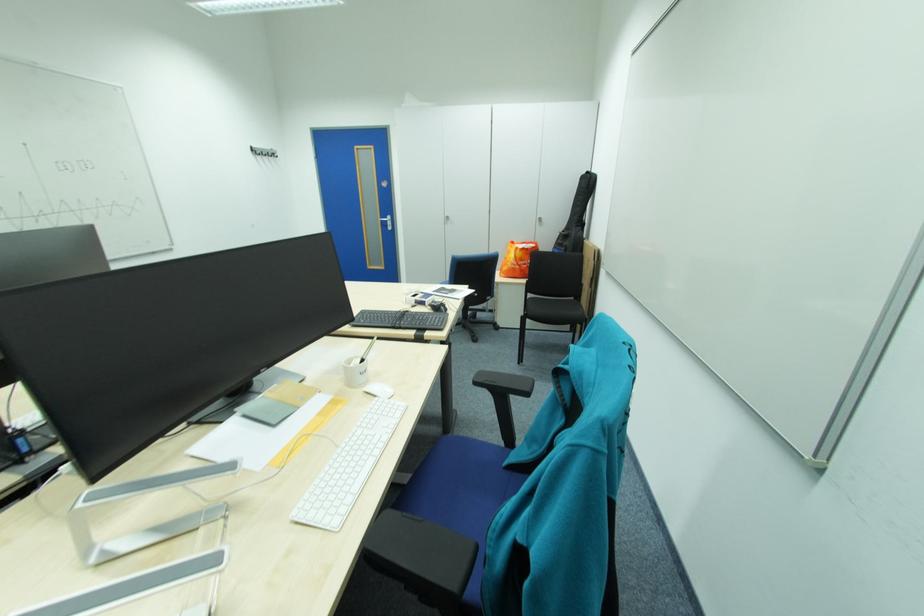
Where would you pull the silver door handle? Please return your answer as a coordinate pair (x, y).

(386, 222)